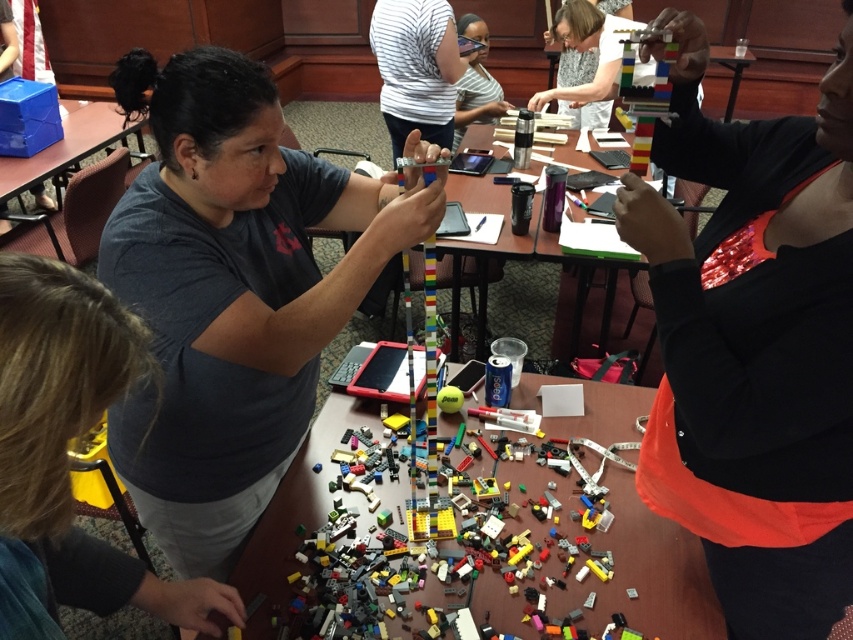
Can you confirm if matte gray shirt at upper center is positioned below translucent purple cup at center?

Indeed, matte gray shirt at upper center is positioned under translucent purple cup at center.

Can you confirm if matte gray shirt at upper center is taller than translucent purple cup at center?

No.

Which is behind, point (15, 536) or point (529, 246)?

The point (529, 246) is behind.

Image resolution: width=853 pixels, height=640 pixels. Identify the location of matte gray shirt at upper center. 71,436.

Describe the element at coordinates (753, 348) in the screenshot. I see `shiny metallic bracelet at upper right` at that location.

Is point (728, 253) more distant than point (451, 253)?

That is False.

Measure the distance between point (680, 17) and camera.

3.47 feet

This screenshot has height=640, width=853. In order to click on shiny metallic bracelet at upper right in this screenshot , I will do `click(753, 348)`.

Who is more distant from viewer, (90, 298) or (109, 122)?

The point (109, 122) is more distant.

Measure the distance between point [102,588] and camera.

The distance of point [102,588] from camera is 36.76 inches.

Is point (97, 291) positioned after point (74, 145)?

No, it is in front of (74, 145).

Identify the location of matte gray shirt at upper center. The height and width of the screenshot is (640, 853). (71, 436).